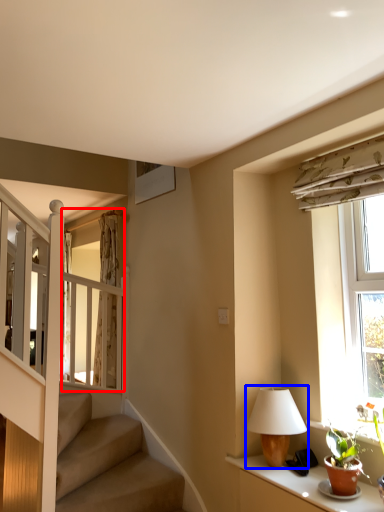
Question: Which object is further to the camera taking this photo, glass door (highlighted by a red box) or table lamp (highlighted by a blue box)?

Choices:
 (A) glass door
 (B) table lamp

Answer: (A)